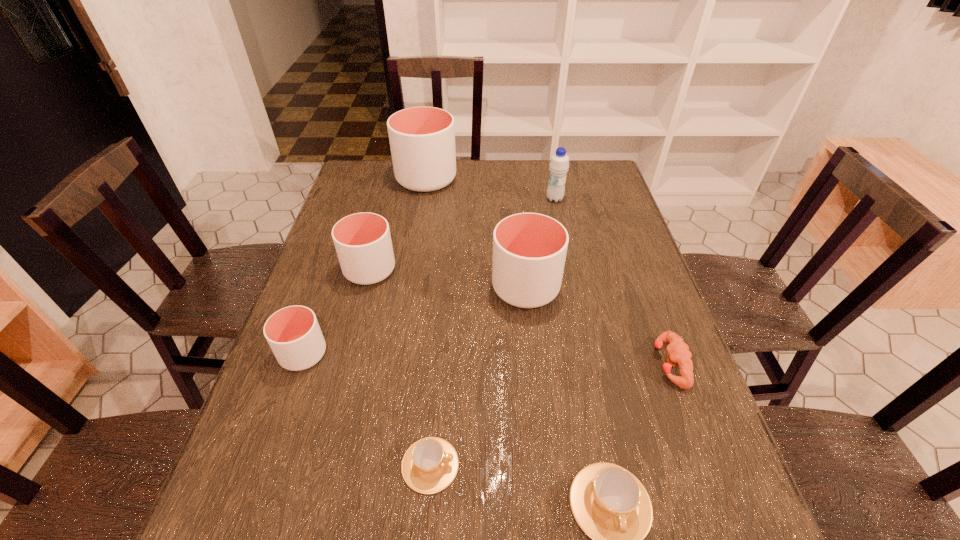
This screenshot has width=960, height=540. In order to click on vacant space at the far right corner in this screenshot , I will do `click(578, 181)`.

This screenshot has width=960, height=540. Find the location of `vacant space at the near right corner of the desktop`. vacant space at the near right corner of the desktop is located at coordinates (706, 534).

Where is `unoccupied position between the left brown cup and the fifth shortest cup`? The image size is (960, 540). unoccupied position between the left brown cup and the fifth shortest cup is located at coordinates (478, 376).

This screenshot has height=540, width=960. I want to click on vacant space that is in between the fourth shortest cup and the shortest cup, so click(x=400, y=367).

You are a GUI agent. You are given a task and a screenshot of the screen. Output one action in this format:
    pyautogui.click(x=<x>, y=<y>)
    Task: Click on the vacant space that's between the second biggest white cup and the fourth shortest cup
    This screenshot has width=960, height=540.
    Given the screenshot: What is the action you would take?
    pyautogui.click(x=447, y=279)

Locate an element on the screen. This screenshot has height=540, width=960. free area in between the second tallest cup and the farthest white cup is located at coordinates (476, 233).

Image resolution: width=960 pixels, height=540 pixels. Find the location of `free area in between the second smallest white cup and the puncher`. free area in between the second smallest white cup and the puncher is located at coordinates (519, 316).

This screenshot has width=960, height=540. In order to click on free space between the shortest cup and the blue water bottle in this screenshot , I will do `click(492, 332)`.

You are a GUI agent. You are given a task and a screenshot of the screen. Output one action in this format:
    pyautogui.click(x=<x>, y=<y>)
    Task: Click on the vacant region between the blue water bottle and the rightmost object
    This screenshot has width=960, height=540.
    Given the screenshot: What is the action you would take?
    pyautogui.click(x=612, y=281)

Find the location of a particular element. Image resolution: width=960 pixels, height=540 pixels. object that is the third closest to the right brown cup is located at coordinates (529, 249).